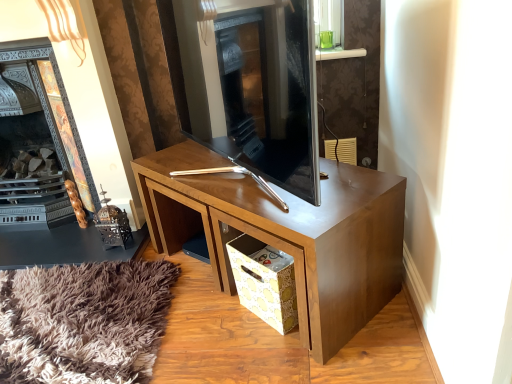
Where is `wooden desk at center`? The image size is (512, 384). wooden desk at center is located at coordinates (288, 234).

This screenshot has width=512, height=384. What do you see at coordinates (264, 281) in the screenshot?
I see `yellow paper bag at lower center` at bounding box center [264, 281].

Find the location of a particular element. This screenshot has height=384, width=512. yellow paper bag at lower center is located at coordinates (264, 281).

In order to click on dark wood fireplace at left, which is the 1th fireplace in left-to-right order in this screenshot , I will do pos(51,138).

Locate an element on the screen. This screenshot has width=512, height=384. wooden desk at center is located at coordinates (288, 234).

Is point (341, 185) less distant than point (289, 93)?

No, (341, 185) is further to viewer.

Which of these two, wooden desk at center or dark gray stone fireplace at center, which ranks as the first fireplace in right-to-left order, is smaller?

With smaller size is dark gray stone fireplace at center, which ranks as the first fireplace in right-to-left order.

In order to click on the 2nd fireplace above the wooden desk at center (from a real-world perspective) in this screenshot , I will do `click(253, 86)`.

From a real-world perspective, which object stands above the other?

From a 3D spatial view, dark gray stone fireplace at center, which ranks as the 2th fireplace in left-to-right order, is above.

From the image's perspective, which object appears higher, wooden desk at center or yellow paper bag at lower center?

wooden desk at center appears higher in the image.

Locate an element on the screen. The image size is (512, 384). desk that is above the yellow paper bag at lower center (from the image's perspective) is located at coordinates (288, 234).

Does wooden desk at center have a greater height compared to yellow paper bag at lower center?

Yes, wooden desk at center is taller than yellow paper bag at lower center.

Which of these two, yellow paper bag at lower center or dark gray stone fireplace at center, which ranks as the 2th fireplace in left-to-right order, stands taller?

Standing taller between the two is dark gray stone fireplace at center, which ranks as the 2th fireplace in left-to-right order.

Considering the positions of point (226, 245) and point (207, 21), is point (226, 245) closer or farther from the camera than point (207, 21)?

Point (226, 245).

In the scene shown: Could you measure the distance between yellow paper bag at lower center and dark gray stone fireplace at center, which ranks as the 2th fireplace in left-to-right order?

yellow paper bag at lower center is 18.28 inches from dark gray stone fireplace at center, which ranks as the 2th fireplace in left-to-right order.

Considering the sizes of objects yellow paper bag at lower center and dark gray stone fireplace at center, which ranks as the first fireplace in right-to-left order, in the image provided, who is bigger, yellow paper bag at lower center or dark gray stone fireplace at center, which ranks as the first fireplace in right-to-left order,?

dark gray stone fireplace at center, which ranks as the first fireplace in right-to-left order, is bigger.

In the scene shown: Is dark wood fireplace at left, which is the 1th fireplace in left-to-right order, located outside wooden desk at center?

Yes, dark wood fireplace at left, which is the 1th fireplace in left-to-right order, is located beyond the bounds of wooden desk at center.

Looking at this image, between dark wood fireplace at left, arranged as the 2th fireplace when viewed from the right, and wooden desk at center, which one has larger size?

With larger size is wooden desk at center.

Considering the positions of objects dark wood fireplace at left, which is the 1th fireplace in left-to-right order, and wooden desk at center in the image provided, who is more to the right, dark wood fireplace at left, which is the 1th fireplace in left-to-right order, or wooden desk at center?

wooden desk at center is more to the right.

Is dark wood fireplace at left, arranged as the 2th fireplace when viewed from the right, oriented away from wooden desk at center?

No, dark wood fireplace at left, arranged as the 2th fireplace when viewed from the right, is not facing away from wooden desk at center.

Is dark gray stone fireplace at center, which ranks as the 2th fireplace in left-to-right order, not inside dark wood fireplace at left, arranged as the 2th fireplace when viewed from the right?

Yes, dark gray stone fireplace at center, which ranks as the 2th fireplace in left-to-right order, is not within dark wood fireplace at left, arranged as the 2th fireplace when viewed from the right.

Does dark gray stone fireplace at center, which ranks as the first fireplace in right-to-left order, have a greater height compared to dark wood fireplace at left, arranged as the 2th fireplace when viewed from the right?

In fact, dark gray stone fireplace at center, which ranks as the first fireplace in right-to-left order, may be shorter than dark wood fireplace at left, arranged as the 2th fireplace when viewed from the right.

Find the location of `fireplace below the dark gray stone fireplace at center, which ranks as the first fireplace in right-to-left order (from the image's perspective)`. fireplace below the dark gray stone fireplace at center, which ranks as the first fireplace in right-to-left order (from the image's perspective) is located at coordinates (51, 138).

Is point (265, 149) farther from viewer compared to point (292, 307)?

No, (265, 149) is in front of (292, 307).

Which object is wider, dark gray stone fireplace at center, which ranks as the 2th fireplace in left-to-right order, or yellow paper bag at lower center?

With larger width is dark gray stone fireplace at center, which ranks as the 2th fireplace in left-to-right order.

Considering the sizes of objects dark gray stone fireplace at center, which ranks as the 2th fireplace in left-to-right order, and yellow paper bag at lower center in the image provided, who is smaller, dark gray stone fireplace at center, which ranks as the 2th fireplace in left-to-right order, or yellow paper bag at lower center?

yellow paper bag at lower center is smaller.

Relative to yellow paper bag at lower center, is dark gray stone fireplace at center, which ranks as the first fireplace in right-to-left order, in front or behind?

dark gray stone fireplace at center, which ranks as the first fireplace in right-to-left order, is positioned closer to the viewer than yellow paper bag at lower center.

In the scene shown: From the image's perspective, is yellow paper bag at lower center on top of wooden desk at center?

No, from the image's perspective, yellow paper bag at lower center is not on top of wooden desk at center.

Which point is more distant from viewer, (259, 255) or (245, 232)?

The point (259, 255) is more distant.

Identify the location of desk above the yellow paper bag at lower center (from a real-world perspective). Image resolution: width=512 pixels, height=384 pixels. (288, 234).

The width and height of the screenshot is (512, 384). I want to click on desk behind the dark gray stone fireplace at center, which ranks as the 2th fireplace in left-to-right order, so click(x=288, y=234).

Find the location of a particular element. The width and height of the screenshot is (512, 384). desk lying on the left of yellow paper bag at lower center is located at coordinates (288, 234).

Considering their positions, is dark wood fireplace at left, arranged as the 2th fireplace when viewed from the right, positioned closer to dark gray stone fireplace at center, which ranks as the 2th fireplace in left-to-right order, than wooden desk at center?

The object closer to dark gray stone fireplace at center, which ranks as the 2th fireplace in left-to-right order, is wooden desk at center.

Which object lies nearer to the anchor point dark gray stone fireplace at center, which ranks as the 2th fireplace in left-to-right order, yellow paper bag at lower center or wooden desk at center?

wooden desk at center lies closer to dark gray stone fireplace at center, which ranks as the 2th fireplace in left-to-right order, than the other object.

When comparing their distances from yellow paper bag at lower center, does dark gray stone fireplace at center, which ranks as the 2th fireplace in left-to-right order, or dark wood fireplace at left, which is the 1th fireplace in left-to-right order, seem closer?

Based on the image, dark gray stone fireplace at center, which ranks as the 2th fireplace in left-to-right order, appears to be nearer to yellow paper bag at lower center.

Looking at the image, which one is located closer to yellow paper bag at lower center, dark wood fireplace at left, arranged as the 2th fireplace when viewed from the right, or dark gray stone fireplace at center, which ranks as the 2th fireplace in left-to-right order?

Among the two, dark gray stone fireplace at center, which ranks as the 2th fireplace in left-to-right order, is located nearer to yellow paper bag at lower center.

Consider the image. From the image, which object appears to be nearer to dark gray stone fireplace at center, which ranks as the first fireplace in right-to-left order, wooden desk at center or yellow paper bag at lower center?

wooden desk at center is positioned closer to the anchor dark gray stone fireplace at center, which ranks as the first fireplace in right-to-left order.

From the image, which object appears to be nearer to yellow paper bag at lower center, wooden desk at center or dark wood fireplace at left, which is the 1th fireplace in left-to-right order?

wooden desk at center is closer to yellow paper bag at lower center.

From the image, which object appears to be farther from wooden desk at center, dark gray stone fireplace at center, which ranks as the first fireplace in right-to-left order, or yellow paper bag at lower center?

dark gray stone fireplace at center, which ranks as the first fireplace in right-to-left order, is positioned further to the anchor wooden desk at center.

Based on the photo, considering their positions, is wooden desk at center positioned closer to dark gray stone fireplace at center, which ranks as the first fireplace in right-to-left order, than dark wood fireplace at left, arranged as the 2th fireplace when viewed from the right?

The object closer to dark gray stone fireplace at center, which ranks as the first fireplace in right-to-left order, is wooden desk at center.

Identify the location of desk between dark wood fireplace at left, which is the 1th fireplace in left-to-right order, and yellow paper bag at lower center. The width and height of the screenshot is (512, 384). (288, 234).

I want to click on desk between dark gray stone fireplace at center, which ranks as the 2th fireplace in left-to-right order, and yellow paper bag at lower center vertically, so click(288, 234).

Locate an element on the screen. This screenshot has height=384, width=512. fireplace located between dark wood fireplace at left, arranged as the 2th fireplace when viewed from the right, and yellow paper bag at lower center in the left-right direction is located at coordinates (253, 86).

This screenshot has height=384, width=512. I want to click on fireplace situated between dark wood fireplace at left, arranged as the 2th fireplace when viewed from the right, and wooden desk at center from left to right, so click(253, 86).